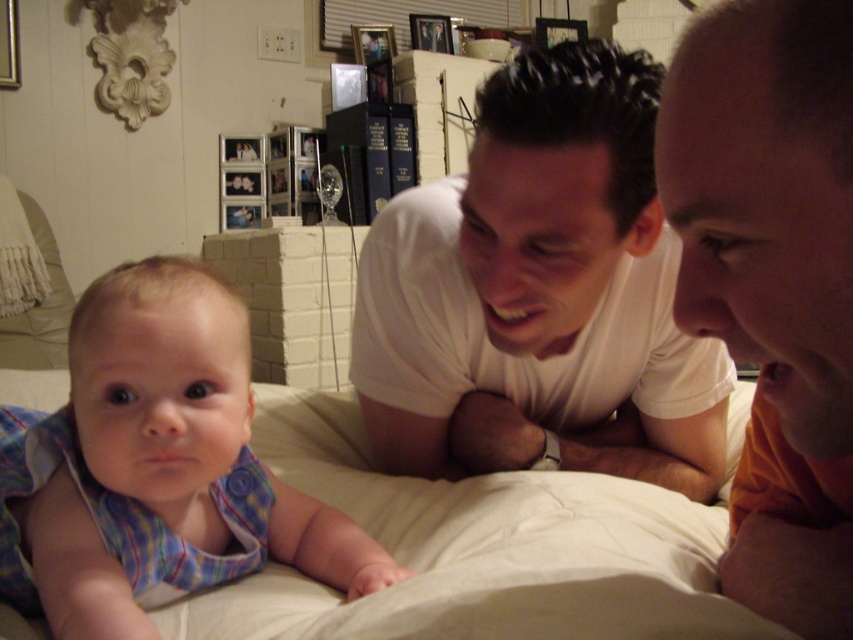
Question: Which point appears farthest from the camera in this image?

Choices:
 (A) (315, 589)
 (B) (433, 312)
 (C) (103, 435)

Answer: (B)

Question: Which point appears farthest from the camera in this image?

Choices:
 (A) (125, 544)
 (B) (641, 259)
 (C) (846, 4)

Answer: (B)

Question: Does white matte shirt at upper center appear on the left side of plaid fabric baby at lower left?

Choices:
 (A) yes
 (B) no

Answer: (B)

Question: Does white matte shirt at upper center appear on the right side of plaid fabric baby at lower left?

Choices:
 (A) no
 (B) yes

Answer: (B)

Question: Which of the following is the closest to the observer?

Choices:
 (A) plaid fabric baby at lower left
 (B) white soft bed at center
 (C) white matte shirt at upper center
 (D) white smooth t-shirt at center

Answer: (C)

Question: Can you confirm if white smooth t-shirt at center is wider than white matte shirt at upper center?

Choices:
 (A) no
 (B) yes

Answer: (B)